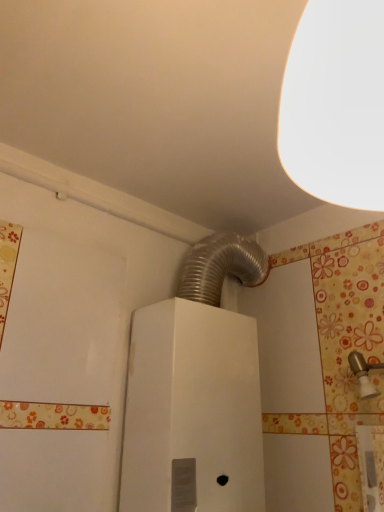
What are the coordinates of `brushed metal faucet at upper right` in the screenshot? It's located at (364, 374).

In order to click on white matte lampshade at upper right in this screenshot , I will do `click(336, 104)`.

Identify the location of white metallic water heater at center. This screenshot has height=512, width=384. (192, 411).

This screenshot has height=512, width=384. In order to click on brushed metal faucet at upper right in this screenshot , I will do `click(364, 374)`.

Between white metallic water heater at center and brushed metal faucet at upper right, which one has larger width?

white metallic water heater at center is wider.

Does white metallic water heater at center contain brushed metal faucet at upper right?

That's incorrect, brushed metal faucet at upper right is not inside white metallic water heater at center.

Which object is closer to the camera, white metallic water heater at center or brushed metal faucet at upper right?

brushed metal faucet at upper right.

From a real-world perspective, does white metallic water heater at center sit lower than brushed metal faucet at upper right?

No, from a real-world perspective, white metallic water heater at center is not under brushed metal faucet at upper right.

Between white matte lampshade at upper right and brushed metal faucet at upper right, which one has smaller size?

brushed metal faucet at upper right is smaller.

From the image's perspective, which object appears higher, white matte lampshade at upper right or brushed metal faucet at upper right?

From the image's view, white matte lampshade at upper right is above.

Does white matte lampshade at upper right have a lesser width compared to brushed metal faucet at upper right?

In fact, white matte lampshade at upper right might be wider than brushed metal faucet at upper right.

From a real-world perspective, is white matte lampshade at upper right on brushed metal faucet at upper right?

Correct, in the physical world, white matte lampshade at upper right is higher than brushed metal faucet at upper right.

Considering the sizes of objects brushed metal faucet at upper right and white matte lampshade at upper right in the image provided, who is bigger, brushed metal faucet at upper right or white matte lampshade at upper right?

Bigger between the two is white matte lampshade at upper right.

Is white matte lampshade at upper right at the back of brushed metal faucet at upper right?

brushed metal faucet at upper right is not turned away from white matte lampshade at upper right.

Are brushed metal faucet at upper right and white matte lampshade at upper right far apart?

No, brushed metal faucet at upper right is not far from white matte lampshade at upper right.

Which of these two, brushed metal faucet at upper right or white matte lampshade at upper right, stands taller?

white matte lampshade at upper right.

Which point is more distant from viewer, (378, 23) or (184, 375)?

The point (184, 375) is farther from the camera.

Are white matte lampshade at upper right and white metallic water heater at center beside each other?

white matte lampshade at upper right and white metallic water heater at center are clearly separated.

Considering the relative sizes of white matte lampshade at upper right and white metallic water heater at center in the image provided, is white matte lampshade at upper right shorter than white metallic water heater at center?

Yes, white matte lampshade at upper right is shorter than white metallic water heater at center.

What's the angular difference between white matte lampshade at upper right and white metallic water heater at center's facing directions?

They differ by 87.6 degrees in their facing directions.

Locate an element on the screen. lamp above the white metallic water heater at center (from a real-world perspective) is located at coordinates (336, 104).

Considering the sizes of objects white metallic water heater at center and white matte lampshade at upper right in the image provided, who is bigger, white metallic water heater at center or white matte lampshade at upper right?

Bigger between the two is white metallic water heater at center.

Is white metallic water heater at center positioned behind white matte lampshade at upper right?

Yes, it is behind white matte lampshade at upper right.

Which object is more forward, brushed metal faucet at upper right or white metallic water heater at center?

Positioned in front is brushed metal faucet at upper right.

Find the location of a particular element. This screenshot has height=512, width=384. plumbing fixture lying on the right of white metallic water heater at center is located at coordinates (364, 374).

Between brushed metal faucet at upper right and white metallic water heater at center, which one has more height?

white metallic water heater at center.

Which object is positioned more to the right, brushed metal faucet at upper right or white metallic water heater at center?

From the viewer's perspective, brushed metal faucet at upper right appears more on the right side.

The width and height of the screenshot is (384, 512). Identify the location of water heater located on the left of brushed metal faucet at upper right. (192, 411).

This screenshot has height=512, width=384. What are the coordinates of `plumbing fixture behind the white matte lampshade at upper right` in the screenshot? It's located at (364, 374).

Considering their positions, is white matte lampshade at upper right positioned further to brushed metal faucet at upper right than white metallic water heater at center?

white matte lampshade at upper right is positioned further to the anchor brushed metal faucet at upper right.

Based on their spatial positions, is white metallic water heater at center or brushed metal faucet at upper right closer to white matte lampshade at upper right?

The object closer to white matte lampshade at upper right is white metallic water heater at center.

Based on the photo, based on their spatial positions, is white matte lampshade at upper right or brushed metal faucet at upper right closer to white metallic water heater at center?

Among the two, brushed metal faucet at upper right is located nearer to white metallic water heater at center.

When comparing their distances from white matte lampshade at upper right, does brushed metal faucet at upper right or white metallic water heater at center seem further?

brushed metal faucet at upper right is positioned further to the anchor white matte lampshade at upper right.

Based on the photo, which object lies further to the anchor point brushed metal faucet at upper right, white metallic water heater at center or white matte lampshade at upper right?

white matte lampshade at upper right lies further to brushed metal faucet at upper right than the other object.

Considering their positions, is brushed metal faucet at upper right positioned further to white metallic water heater at center than white matte lampshade at upper right?

Based on the image, white matte lampshade at upper right appears to be further to white metallic water heater at center.

The image size is (384, 512). In order to click on plumbing fixture between white matte lampshade at upper right and white metallic water heater at center vertically in this screenshot , I will do `click(364, 374)`.